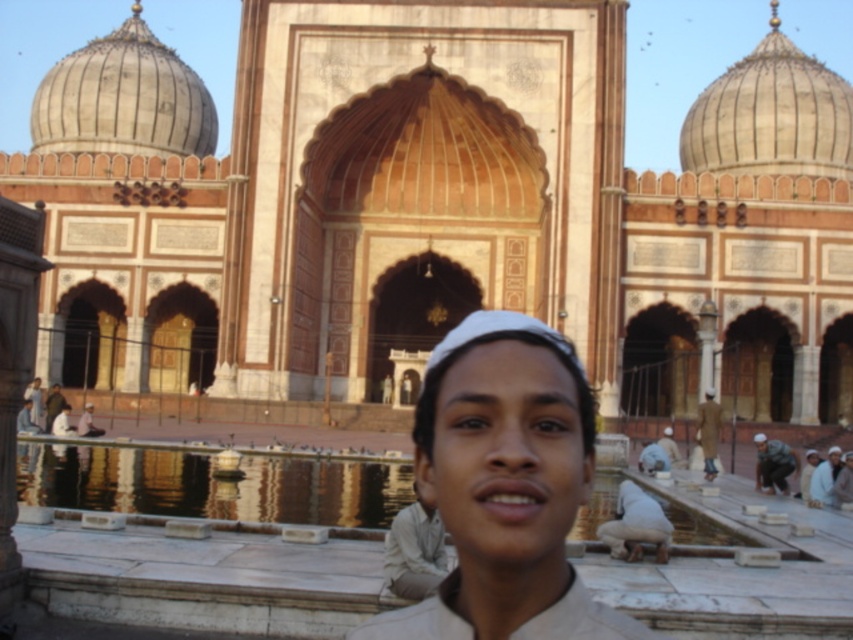
Between matte beige shirt at center and white cotton cap at center, which one is positioned lower?

white cotton cap at center is below.

Identify the location of matte beige shirt at center. The height and width of the screenshot is (640, 853). (503, 486).

Who is lower down, marble water at center or white cotton cap at center?

white cotton cap at center is lower down.

Can you confirm if marble water at center is positioned to the left of white cotton cap at center?

Correct, you'll find marble water at center to the left of white cotton cap at center.

At what (x,y) coordinates should I click in order to perform the action: click on marble water at center. Please return your answer as a coordinate pair (x, y). The width and height of the screenshot is (853, 640). Looking at the image, I should click on pyautogui.click(x=463, y=214).

Which is above, light beige fabric at center or green fabric shirt at lower right?

green fabric shirt at lower right is above.

Can you confirm if light beige fabric at center is positioned below green fabric shirt at lower right?

Yes.

Find the location of a particular element. The width and height of the screenshot is (853, 640). light beige fabric at center is located at coordinates (415, 550).